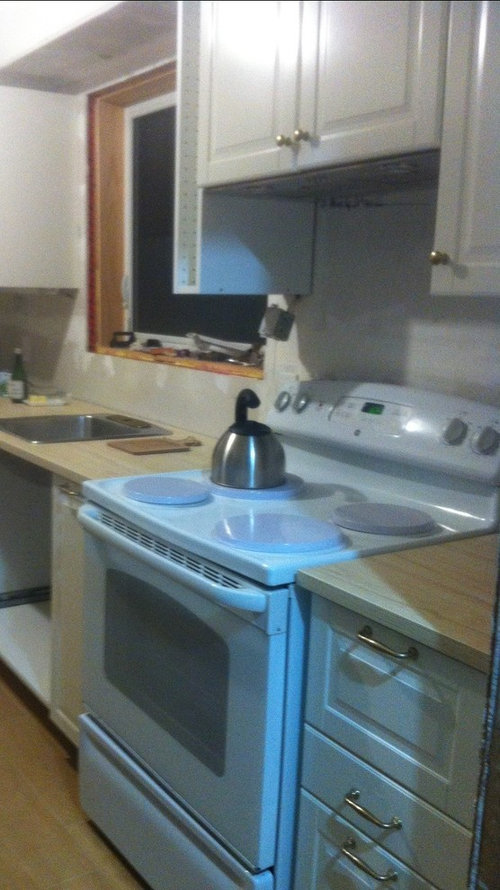
The width and height of the screenshot is (500, 890). In order to click on window in this screenshot , I will do `click(148, 232)`.